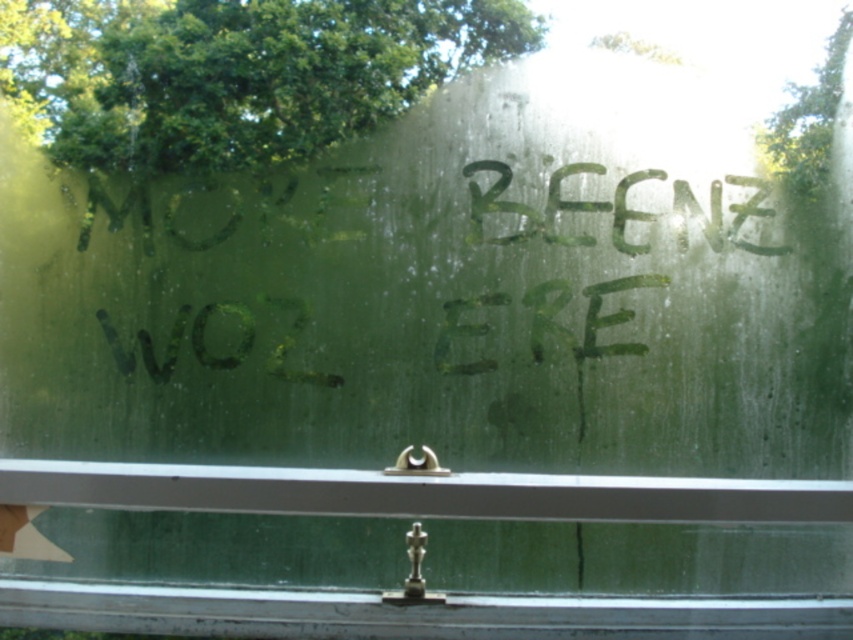
Question: Does metallic silver window sill at lower center have a smaller size compared to green paint at center?

Choices:
 (A) no
 (B) yes

Answer: (A)

Question: Can you confirm if metallic silver window sill at lower center is wider than green paint at center?

Choices:
 (A) no
 (B) yes

Answer: (B)

Question: Among these objects, which one is farthest from the camera?

Choices:
 (A) metallic silver window sill at lower center
 (B) green paint at center

Answer: (B)

Question: Which point is closer to the camera?

Choices:
 (A) (474, 163)
 (B) (53, 616)

Answer: (B)

Question: Which point appears farthest from the camera in this image?

Choices:
 (A) pyautogui.click(x=599, y=630)
 (B) pyautogui.click(x=479, y=211)

Answer: (B)

Question: Can you confirm if metallic silver window sill at lower center is positioned to the right of green paint at center?

Choices:
 (A) yes
 (B) no

Answer: (B)